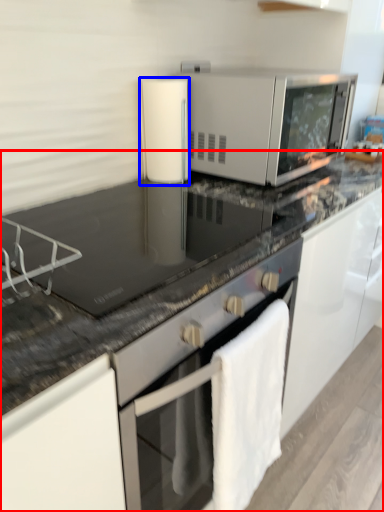
Question: Which object appears closest to the camera in this image, countertop (highlighted by a red box) or appliance (highlighted by a blue box)?

Choices:
 (A) countertop
 (B) appliance

Answer: (A)